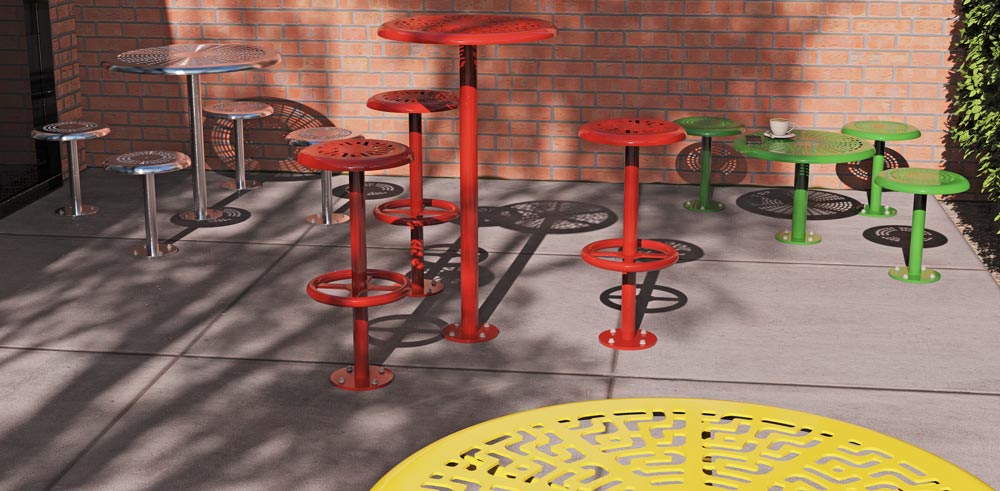
At what (x,y) coordinates should I click in order to perform the action: click on red circle table. Please return your answer as a coordinate pair (x, y). Image resolution: width=1000 pixels, height=491 pixels. Looking at the image, I should click on (458, 38).